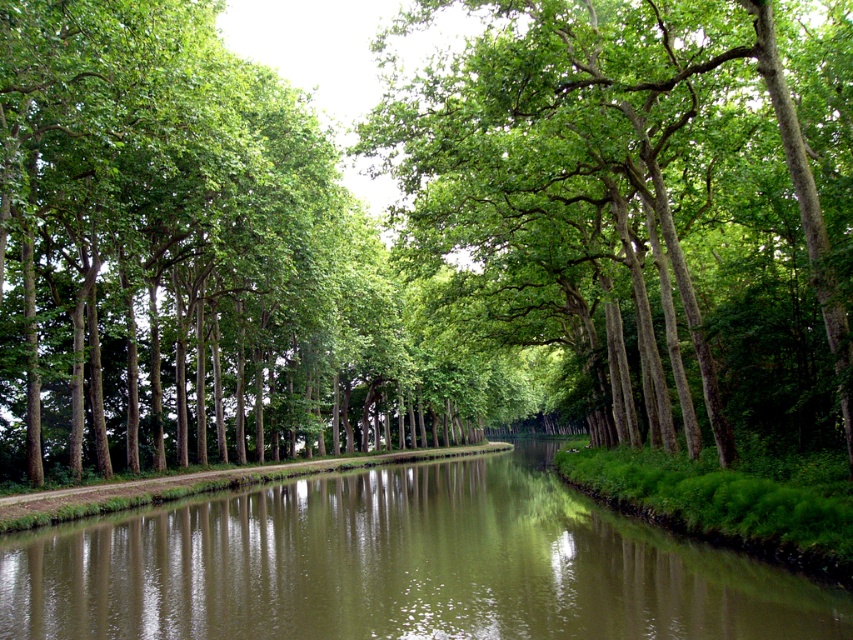
You are standing at the origin point of the coordinate system in the scene. Where are the green leafy trees at center located?

The green leafy trees at center are located at the coordinate point of (x=650, y=195).

You are walking along the canal path and want to take a photo of the green leafy trees at center and the green reflective water at center. Which object should you position to the left side in your camera frame?

You should position the green reflective water at center to the left side in your camera frame because the green leafy trees at center is positioned on the right side of it.

Looking at this image, you are walking along the canal path and want to take a photo that captures both the green leafy trees at center and the green reflective water at center. Since the trees are blocking the view of the water, how can you adjust your position to see both?

Move backward to position yourself further away from the green leafy trees at center so that both the green leafy trees at center and the green reflective water at center come into view.